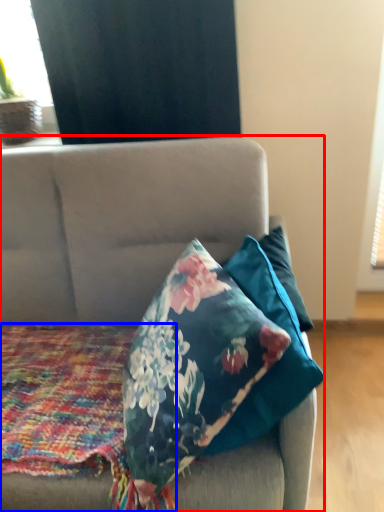
Question: Which object appears closest to the camera in this image, studio couch (highlighted by a red box) or blanket (highlighted by a blue box)?

Choices:
 (A) studio couch
 (B) blanket

Answer: (A)